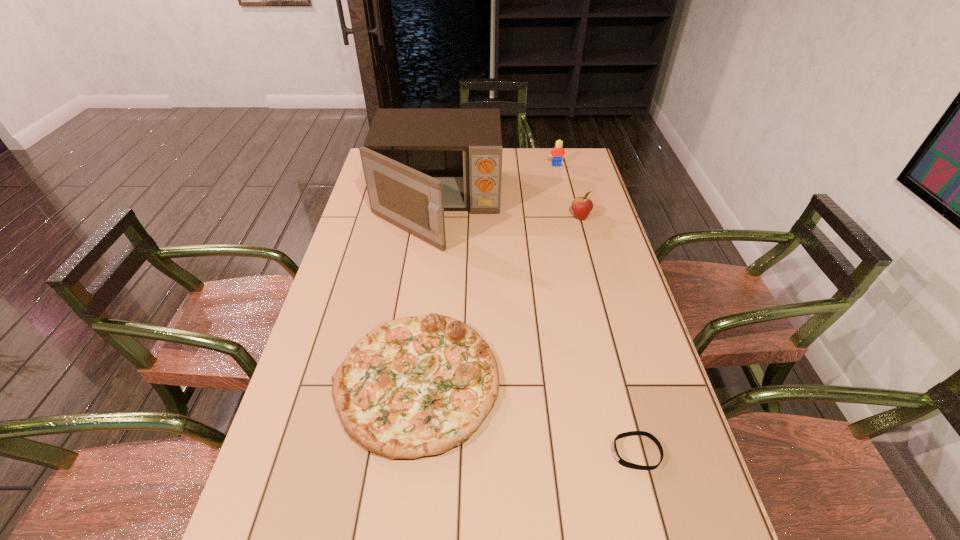
Where is `object present at the far right corner`? This screenshot has width=960, height=540. object present at the far right corner is located at coordinates (558, 152).

Locate an element on the screen. The height and width of the screenshot is (540, 960). free point at the left edge is located at coordinates (362, 228).

Locate an element on the screen. The image size is (960, 540). vacant space at the right edge of the desktop is located at coordinates (660, 393).

Locate an element on the screen. The height and width of the screenshot is (540, 960). empty space that is in between the apple and the microwave oven is located at coordinates (509, 212).

Locate an element on the screen. This screenshot has height=540, width=960. free point between the fourth tallest object and the farthest object is located at coordinates (487, 274).

Where is `vacant space in between the wristband and the second shortest object`? vacant space in between the wristband and the second shortest object is located at coordinates (526, 418).

The width and height of the screenshot is (960, 540). I want to click on blank region between the apple and the fourth tallest object, so click(498, 300).

Where is `object that is the closest to the fourth tallest object`? The height and width of the screenshot is (540, 960). object that is the closest to the fourth tallest object is located at coordinates (622, 462).

Select which object is the closest to the tallest object. Please provide its 2D coordinates. Your answer should be formatted as a tuple, i.e. [(x, y)], where the tuple contains the x and y coordinates of a point satisfying the conditions above.

[(558, 152)]

The height and width of the screenshot is (540, 960). I want to click on vacant space that satisfies the following two spatial constraints: 1. on the face of the apple; 2. on the left side of the farthest object, so click(x=569, y=217).